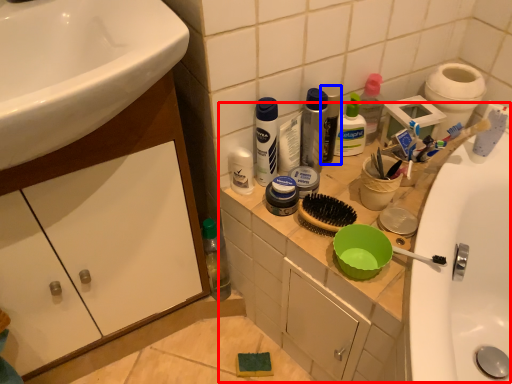
Question: Which object appears farthest to the camera in this image, counter (highlighted by a red box) or mouthwash (highlighted by a blue box)?

Choices:
 (A) counter
 (B) mouthwash

Answer: (B)